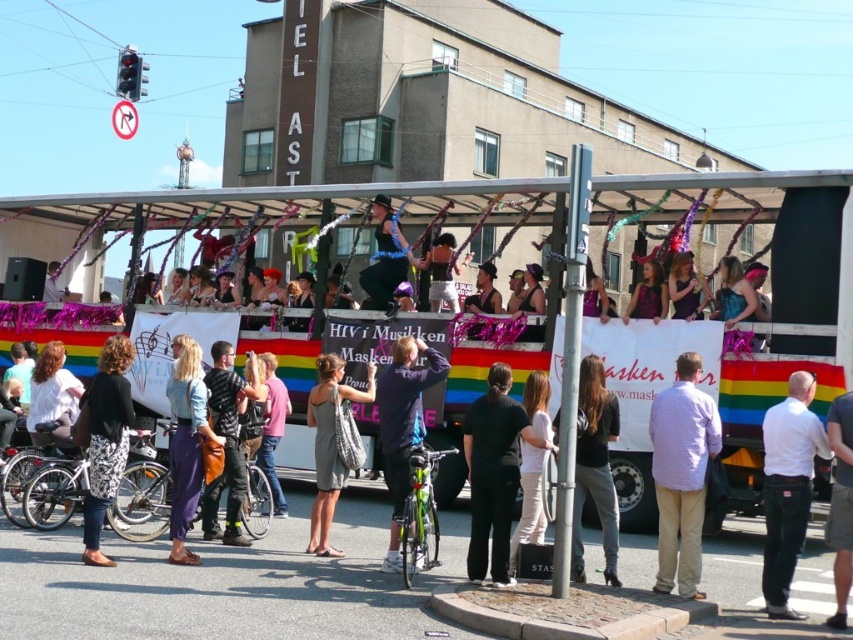
You are a photographer at the parade and want to capture both the light purple checkered shirt at center and the striped cotton shirt at center in a single photo. Which shirt should you focus on to ensure both are in frame?

The light purple checkered shirt at center is taller than the striped cotton shirt at center, so focusing on the taller shirt will help ensure both are in frame.

You are a photographer standing at the back of the vehicle. You want to take a photo that includes both the light purple checkered shirt at center and the striped cotton shirt at center. The camera you are using has a maximum zoom range that can capture objects up to 5 meters apart. Will you be able to capture both shirts in the same photo without moving closer?

The light purple checkered shirt at center and striped cotton shirt at center are 5.56 meters apart from each other. Since the camera can only capture up to 5 meters, you won cannot capture both shirts in the same photo without moving closer.

You are a photographer trying to capture the perfect shot of the two participants in the parade. You notice the black matte pants at center and the black cotton dress at center. Which clothing item is positioned lower in the image?

The black matte pants at center is below black cotton dress at center, so the black matte pants at center is positioned lower in the image.